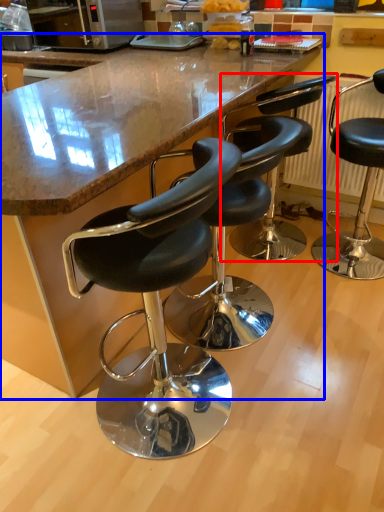
Question: Which object appears farthest to the camera in this image, chair (highlighted by a red box) or counter (highlighted by a blue box)?

Choices:
 (A) chair
 (B) counter

Answer: (A)